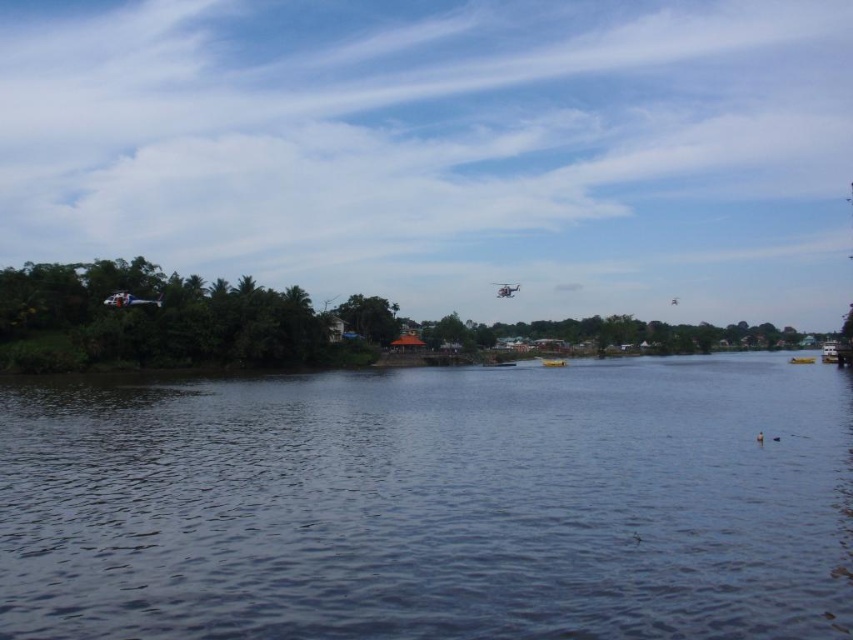
Question: Does dark blue water at center have a larger size compared to yellow matte boat at center?

Choices:
 (A) yes
 (B) no

Answer: (A)

Question: Can you confirm if dark blue water at center is bigger than yellow matte boat at lower right?

Choices:
 (A) no
 (B) yes

Answer: (A)

Question: Which object is positioned closest to the yellow matte boat at lower right?

Choices:
 (A) yellow matte boat at center
 (B) dark blue water at center

Answer: (A)

Question: Among these points, which one is farthest from the camera?

Choices:
 (A) (811, 356)
 (B) (196, 518)

Answer: (A)

Question: Which object is closer to the camera taking this photo?

Choices:
 (A) yellow matte boat at lower right
 (B) dark blue water at center

Answer: (B)

Question: Does dark blue water at center appear under yellow matte boat at lower right?

Choices:
 (A) yes
 (B) no

Answer: (B)